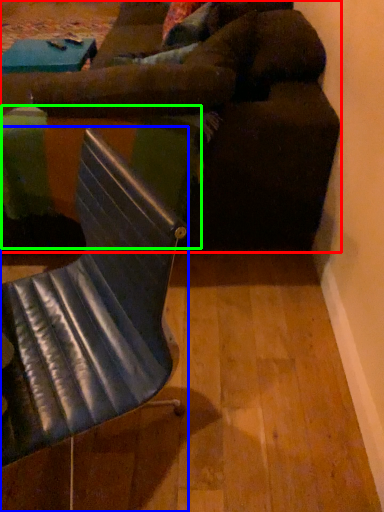
Question: Which object is the farthest from studio couch (highlighted by a red box)? Choose among these: chair (highlighted by a blue box) or table (highlighted by a green box).

Choices:
 (A) chair
 (B) table

Answer: (A)